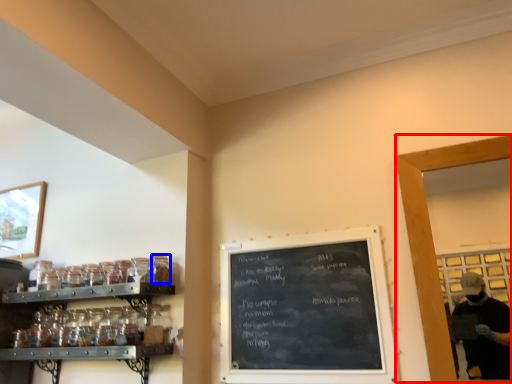
Question: Which of the following is the farthest to the observer, glass door (highlighted by a red box) or glass jar (highlighted by a blue box)?

Choices:
 (A) glass door
 (B) glass jar

Answer: (B)